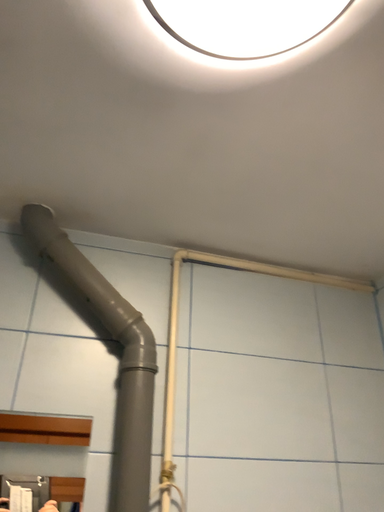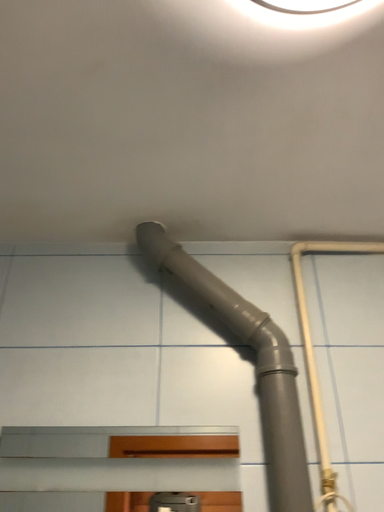
Question: How did the camera likely rotate when shooting the video?

Choices:
 (A) rotated left
 (B) rotated right

Answer: (A)